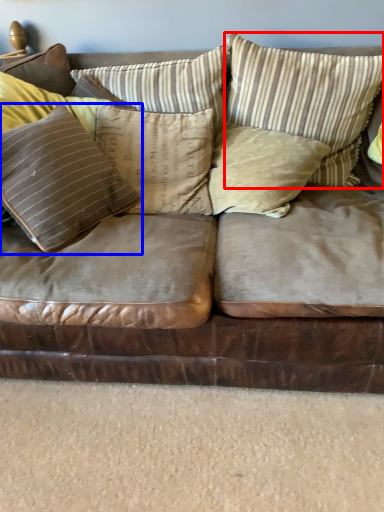
Question: Which object is closer to the camera taking this photo, pillow (highlighted by a red box) or pillow (highlighted by a blue box)?

Choices:
 (A) pillow
 (B) pillow

Answer: (B)